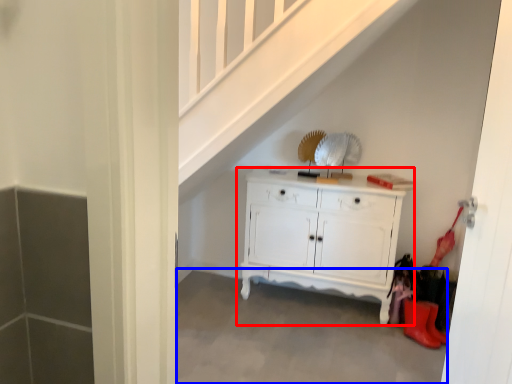
Question: Which of the following is the farthest to the observer, chest of drawers (highlighted by a red box) or concrete (highlighted by a blue box)?

Choices:
 (A) chest of drawers
 (B) concrete

Answer: (A)